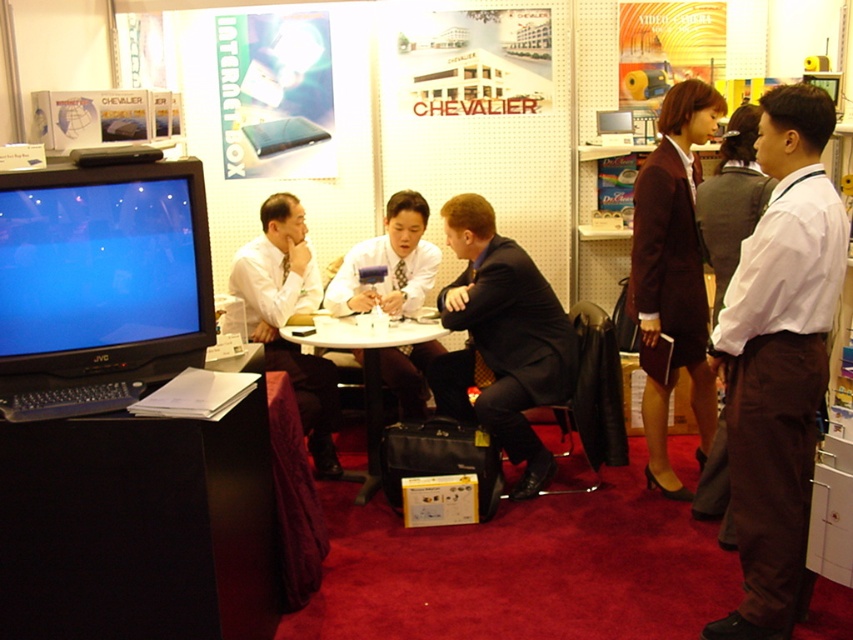
You are a photographer at the event and need to capture a photo of both the white shirt at center and the black suit at center. Which of the two should you focus on first if you want to ensure both are in frame without moving the camera?

The white shirt at center is smaller than the black suit at center, so you should focus on the black suit at center first to ensure it fits within the camera frame before adjusting for the smaller white shirt at center.

You are a photographer at the event and need to capture a photo of the black suit at center and the white plastic table at center. Which object should you focus on first if you want to ensure both are in focus without adjusting the camera settings?

The white plastic table at center is shorter than the black suit at center, so focusing on the black suit at center first would help ensure both are in focus since it is the taller object.